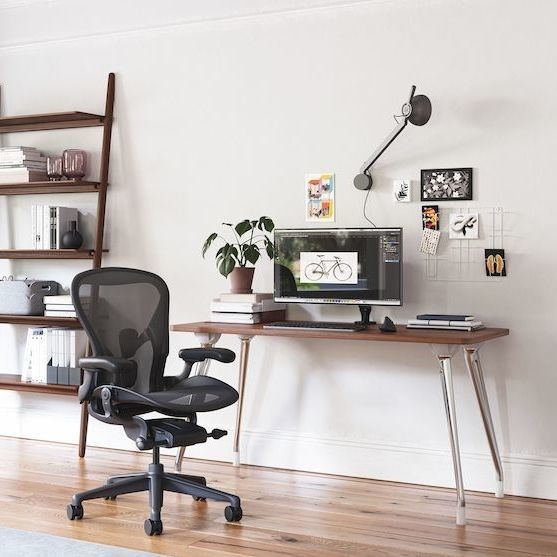
Identify the location of plant. The image size is (557, 557). (249, 249).